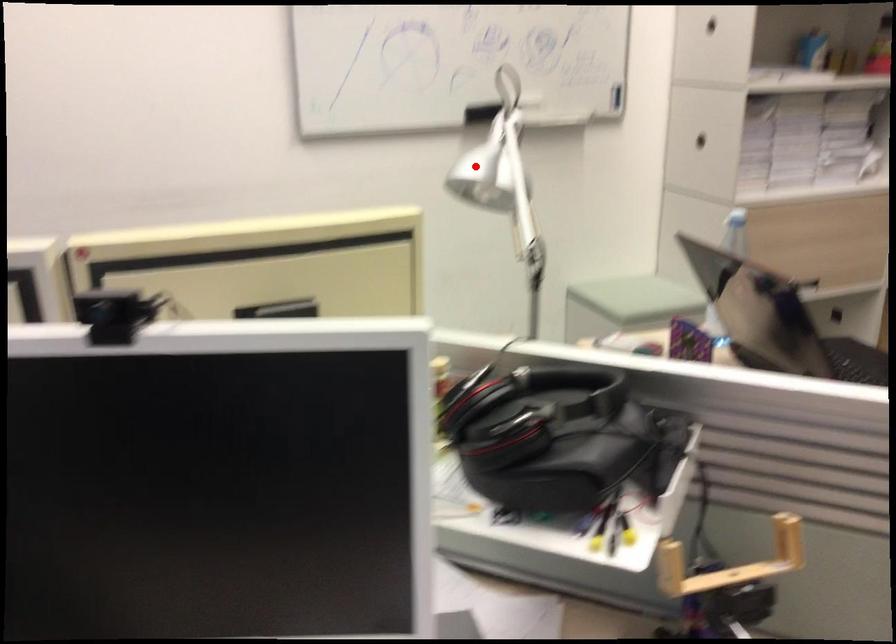
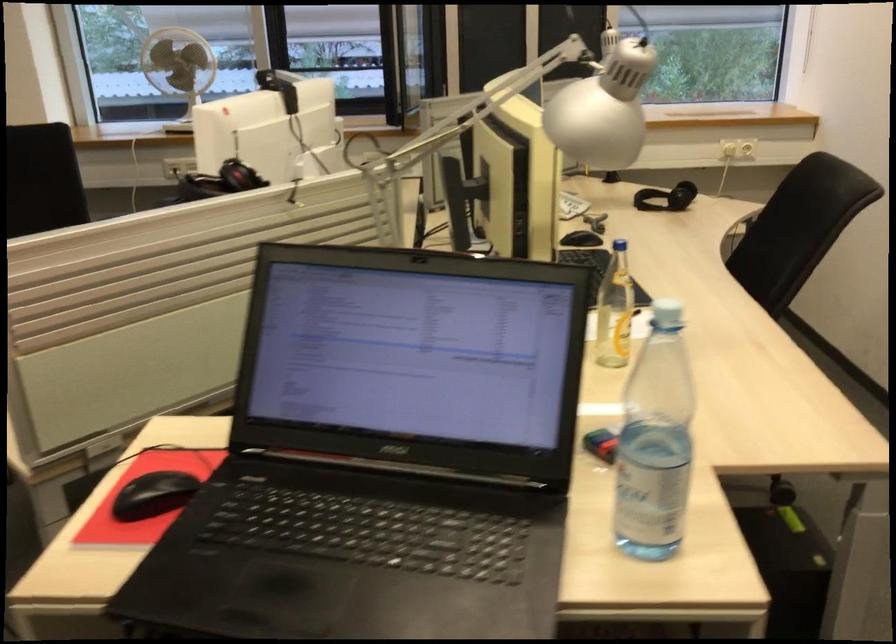
Locate, in the second image, the point that corresponds to the highlighted location in the first image.

(604, 109)